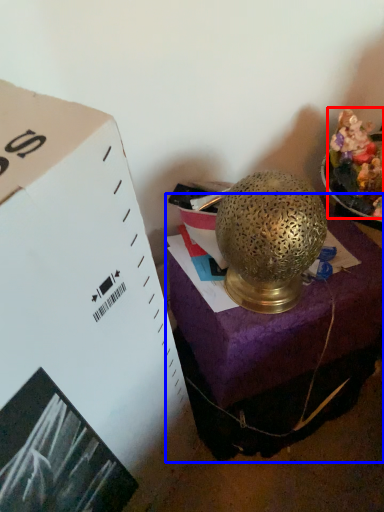
Question: Among these objects, which one is farthest to the camera, food (highlighted by a red box) or furniture (highlighted by a blue box)?

Choices:
 (A) food
 (B) furniture

Answer: (B)